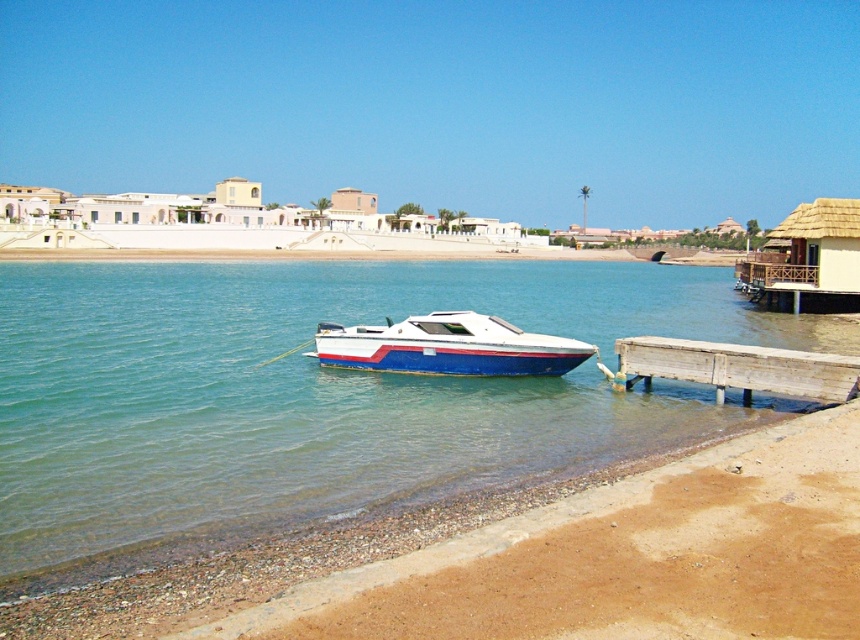
You are standing at the shoreline looking towards the boat. There are two points marked in the scene, one at coordinates point (283,376) and the other at point (852,381). Which point is closer to your current position?

Point (283,376) is closer to your current position because it is further to the camera than point (852,381), meaning it is physically nearer to where you are standing at the shoreline.